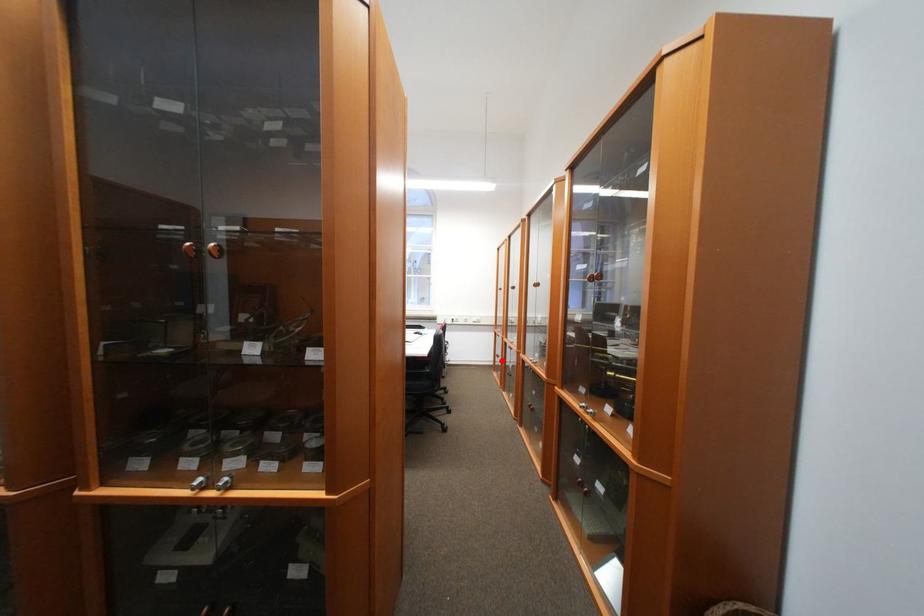
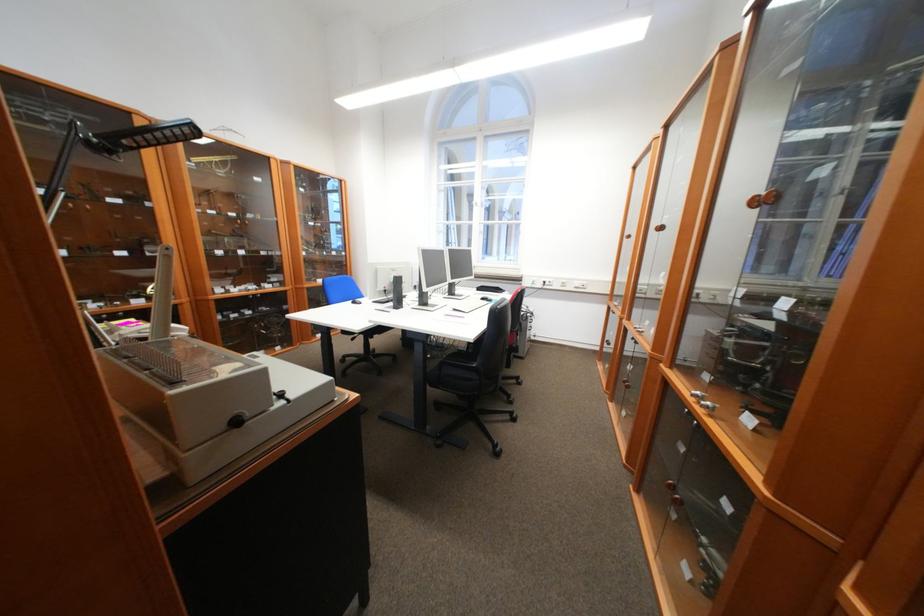
In the second image, find the point that corresponds to the highlighted location in the first image.

(609, 345)